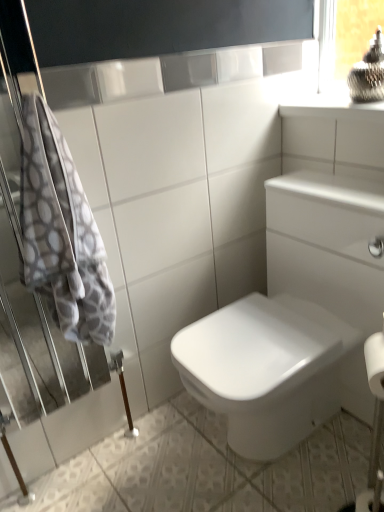
Question: Is white glossy ceramic tile at center positioned with its back to clear glass window frame at upper right?

Choices:
 (A) yes
 (B) no

Answer: (B)

Question: From a real-world perspective, is white glossy ceramic tile at center located higher than clear glass window frame at upper right?

Choices:
 (A) yes
 (B) no

Answer: (B)

Question: Does white glossy ceramic tile at center have a lesser width compared to clear glass window frame at upper right?

Choices:
 (A) yes
 (B) no

Answer: (B)

Question: Is white glossy ceramic tile at center not inside clear glass window frame at upper right?

Choices:
 (A) yes
 (B) no

Answer: (A)

Question: From the image's perspective, is white glossy ceramic tile at center on clear glass window frame at upper right?

Choices:
 (A) no
 (B) yes

Answer: (A)

Question: Is white glossy ceramic tile at center wider than clear glass window frame at upper right?

Choices:
 (A) yes
 (B) no

Answer: (A)

Question: From the image's perspective, would you say white textured towel at left is positioned over clear glass window frame at upper right?

Choices:
 (A) no
 (B) yes

Answer: (A)

Question: Does white textured towel at left come in front of clear glass window frame at upper right?

Choices:
 (A) no
 (B) yes

Answer: (B)

Question: Considering the relative sizes of white textured towel at left and clear glass window frame at upper right in the image provided, is white textured towel at left smaller than clear glass window frame at upper right?

Choices:
 (A) no
 (B) yes

Answer: (A)

Question: From a real-world perspective, does white textured towel at left stand above clear glass window frame at upper right?

Choices:
 (A) yes
 (B) no

Answer: (B)

Question: Considering the relative sizes of white textured towel at left and clear glass window frame at upper right in the image provided, is white textured towel at left bigger than clear glass window frame at upper right?

Choices:
 (A) no
 (B) yes

Answer: (B)

Question: Is white textured towel at left not inside clear glass window frame at upper right?

Choices:
 (A) yes
 (B) no

Answer: (A)

Question: Is white glossy ceramic tile at center outside of white textured towel at left?

Choices:
 (A) yes
 (B) no

Answer: (A)